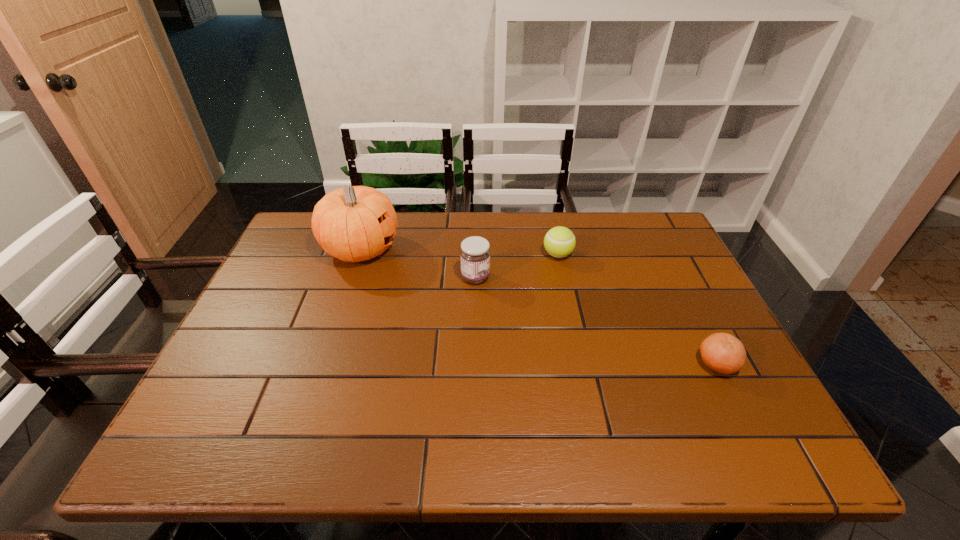
At what (x,y) coordinates should I click in order to perform the action: click on vacant space that satisfies the following two spatial constraints: 1. on the front-facing side of the tallest object; 2. on the back side of the tennis ball. Please return your answer as a coordinate pair (x, y). The height and width of the screenshot is (540, 960). Looking at the image, I should click on (359, 254).

Image resolution: width=960 pixels, height=540 pixels. Find the location of `vacant space that satisfies the following two spatial constraints: 1. on the front side of the third object from left to right; 2. on the right side of the nearest object`. vacant space that satisfies the following two spatial constraints: 1. on the front side of the third object from left to right; 2. on the right side of the nearest object is located at coordinates (582, 364).